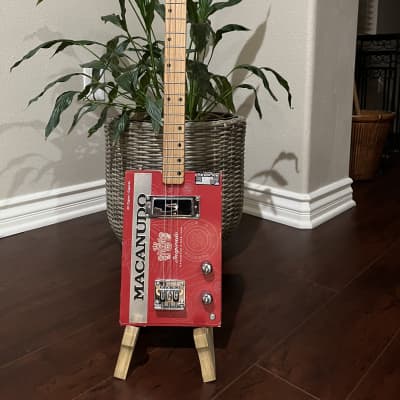
The width and height of the screenshot is (400, 400). What are the coordinates of `wicker baskete` in the screenshot? It's located at (372, 127).